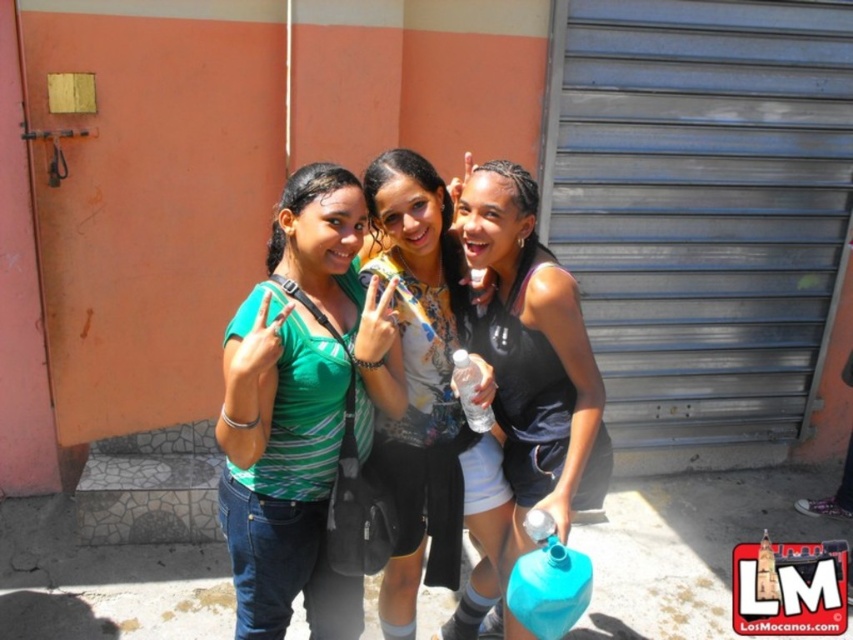
Does point (286, 316) come farther from viewer compared to point (532, 298)?

No, (286, 316) is in front of (532, 298).

Is green striped shirt at center thinner than black matte tank top at center?

In fact, green striped shirt at center might be wider than black matte tank top at center.

Locate an element on the screen. The height and width of the screenshot is (640, 853). green striped shirt at center is located at coordinates (300, 406).

Between metallic gray garage door at right and printed fabric shirt at center, which one has less height?

Standing shorter between the two is printed fabric shirt at center.

Describe the element at coordinates (701, 211) in the screenshot. I see `metallic gray garage door at right` at that location.

Identify the location of metallic gray garage door at right. pos(701,211).

Does green striped shirt at center appear on the right side of printed fabric shirt at center?

In fact, green striped shirt at center is to the left of printed fabric shirt at center.

Is green striped shirt at center wider than printed fabric shirt at center?

Yes.

Measure the distance between green striped shirt at center and camera.

They are 5.46 feet apart.

Identify the location of green striped shirt at center. The height and width of the screenshot is (640, 853). (300, 406).